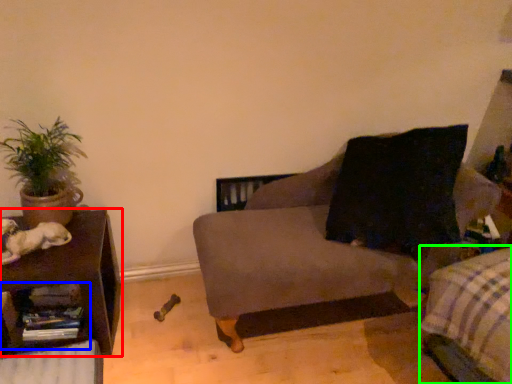
Question: Which is nearer to the table (highlighted by a red box)? shelf (highlighted by a blue box) or bedding (highlighted by a green box).

Choices:
 (A) shelf
 (B) bedding

Answer: (A)